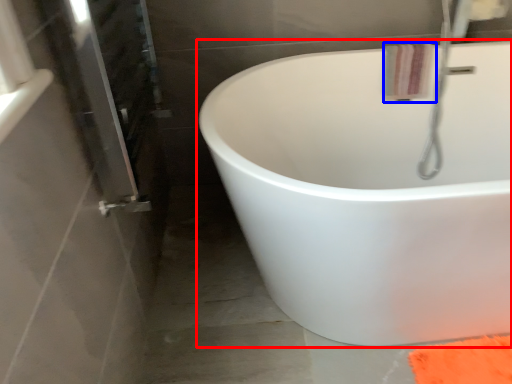
Question: Which point is closer to the camera, bathtub (highlighted by a red box) or bath towel (highlighted by a blue box)?

Choices:
 (A) bathtub
 (B) bath towel

Answer: (A)